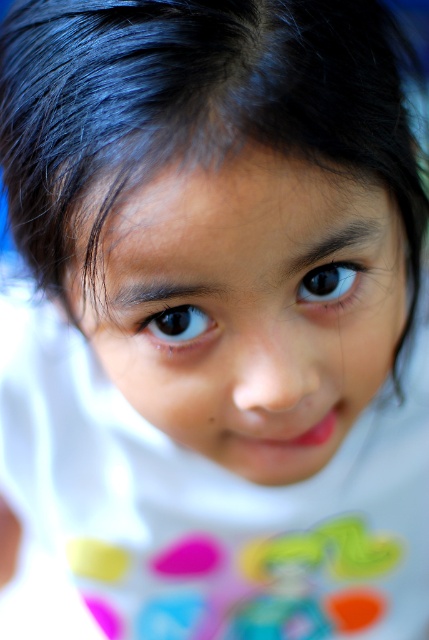
You are taking a photo of the child and want to focus on two points in the image. The first point is at coordinate point [280,184] and the second is at point [162,340]. Which point is closer to the camera?

Point [280,184] is closer to the camera than point [162,340].

You are a photographer adjusting the focus on a camera. The subject has a smooth skin face at center and a black glossy eye at center. Which part should you focus on to ensure the subject is sharp?

The smooth skin face at center is in front of the black glossy eye at center, so focusing on the smooth skin face at center will ensure the subject is sharp.

You are a photographer adjusting the lighting for a portrait. You notice the smooth skin face at center and the black glossy eye at center. Which object should you focus on to ensure proper exposure for the subject?

The smooth skin face at center is positioned under the black glossy eye at center, so focusing on the black glossy eye at center would ensure proper exposure since it is the upper object closer to the light source.